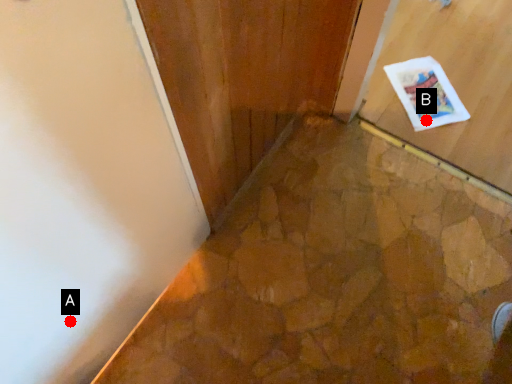
Question: Two points are circled on the image, labeled by A and B beside each circle. Among these points, which one is farthest from the camera?

Choices:
 (A) A is further
 (B) B is further

Answer: (B)